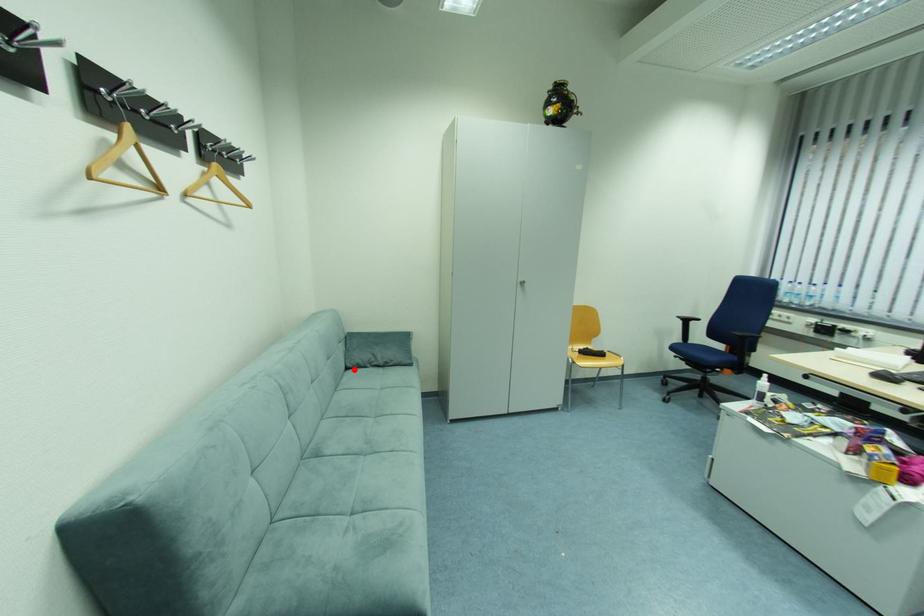
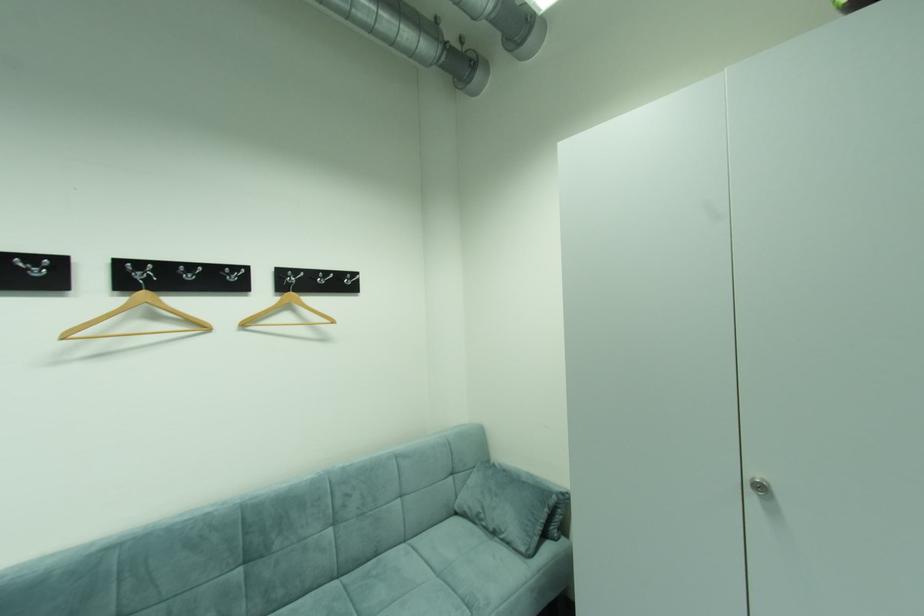
Question: I am providing you with two images of the same scene from different viewpoints. A red point is shown in image1. For the corresponding object point in image2, is it positioned nearer or farther from the camera?

Choices:
 (A) Nearer
 (B) Farther

Answer: (B)